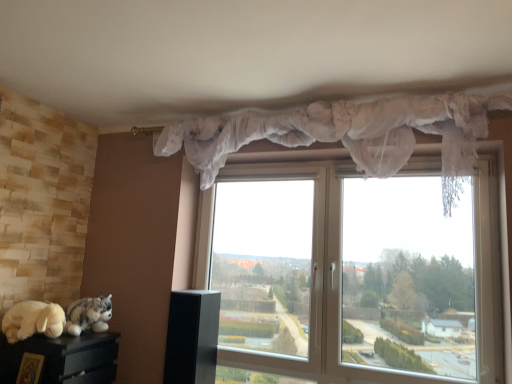
Question: Can you confirm if wooden picture frame at lower left is taller than white plush toy at lower left?

Choices:
 (A) no
 (B) yes

Answer: (B)

Question: Can you confirm if wooden picture frame at lower left is shorter than white plush toy at lower left?

Choices:
 (A) no
 (B) yes

Answer: (A)

Question: Can you confirm if wooden picture frame at lower left is bigger than white plush toy at lower left?

Choices:
 (A) no
 (B) yes

Answer: (A)

Question: Is wooden picture frame at lower left to the left of white plush toy at lower left from the viewer's perspective?

Choices:
 (A) yes
 (B) no

Answer: (B)

Question: Does wooden picture frame at lower left lie behind white plush toy at lower left?

Choices:
 (A) yes
 (B) no

Answer: (B)

Question: From a real-world perspective, is wooden picture frame at lower left physically above white plush toy at lower left?

Choices:
 (A) no
 (B) yes

Answer: (A)

Question: Is transparent plastic window at center positioned with its back to white plush toy at lower left?

Choices:
 (A) no
 (B) yes

Answer: (A)

Question: Can you confirm if transparent plastic window at center is shorter than white plush toy at lower left?

Choices:
 (A) no
 (B) yes

Answer: (A)

Question: Can you confirm if transparent plastic window at center is smaller than white plush toy at lower left?

Choices:
 (A) no
 (B) yes

Answer: (A)

Question: Could you tell me if transparent plastic window at center is facing white plush toy at lower left?

Choices:
 (A) yes
 (B) no

Answer: (B)

Question: Is transparent plastic window at center taller than white plush toy at lower left?

Choices:
 (A) no
 (B) yes

Answer: (B)

Question: Does transparent plastic window at center appear on the left side of white plush toy at lower left?

Choices:
 (A) no
 (B) yes

Answer: (A)

Question: Is fluffy gray plush at lower left thinner than white lace curtain at upper center?

Choices:
 (A) yes
 (B) no

Answer: (A)